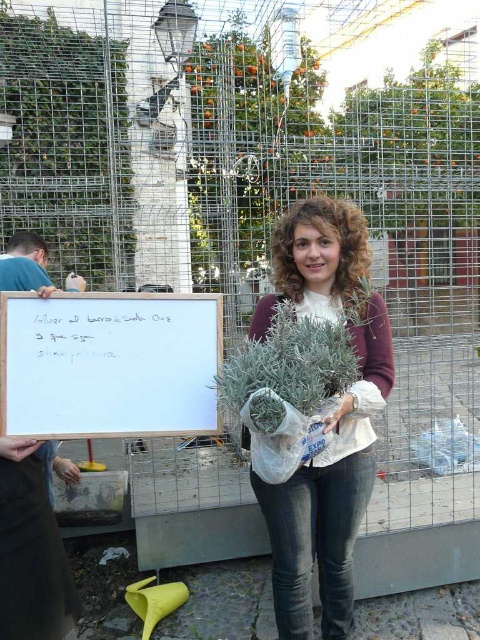
What is the relationship between the height of the matte white sweater at center and the white wooden board at center?

The matte white sweater at center has a greater height compared to the white wooden board at center.

Which object is on the left side between the matte white sweater at center and the green leafy plant at center?

The green leafy plant at center is on the left side because the matte white sweater at center is positioned on the right side of it.